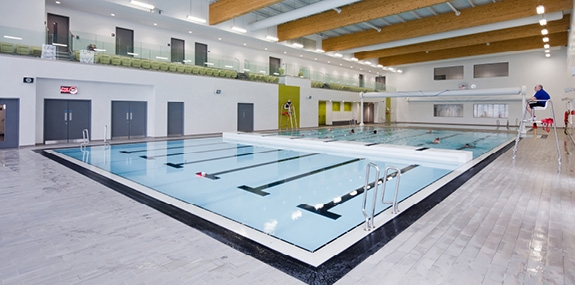
Where is `lights`? This screenshot has width=575, height=285. lights is located at coordinates (550, 54), (543, 34), (539, 13), (242, 31), (271, 36), (298, 47), (322, 53), (145, 6), (380, 65), (391, 72).